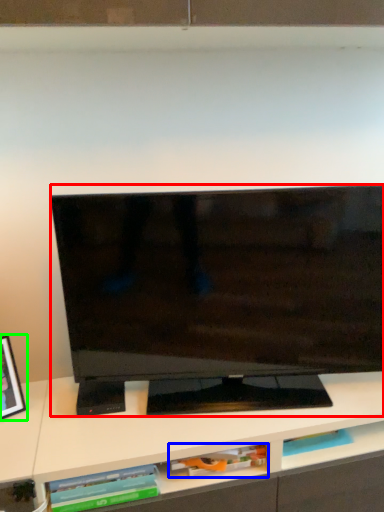
Question: Estimate the real-world distances between objects in this image. Which object is closer to television (highlighted by a red box), book (highlighted by a blue box) or picture frame (highlighted by a green box)?

Choices:
 (A) book
 (B) picture frame

Answer: (A)